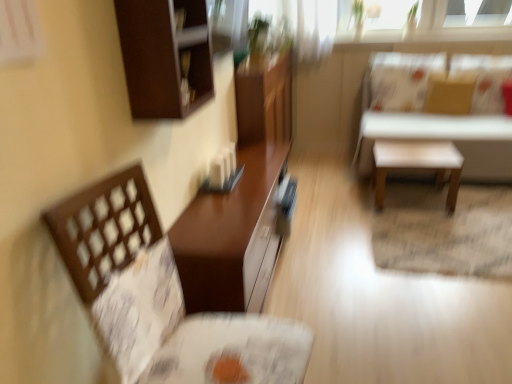
The width and height of the screenshot is (512, 384). Identify the location of free spot above white matte stool at center (from a real-world perspective). click(x=408, y=144).